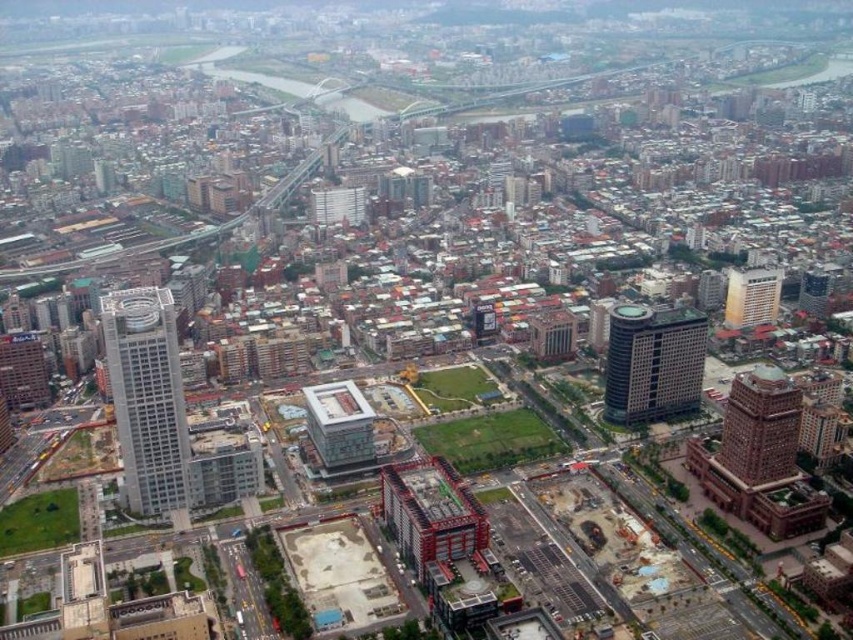
Does silver metallic skyscraper at left have a lesser height compared to white glossy building at upper right?

No, silver metallic skyscraper at left is not shorter than white glossy building at upper right.

Can you confirm if silver metallic skyscraper at left is thinner than white glossy building at upper right?

In fact, silver metallic skyscraper at left might be wider than white glossy building at upper right.

Identify the location of silver metallic skyscraper at left. (148, 396).

Can you confirm if white concrete building at center is taller than matte gray building at center?

Correct, white concrete building at center is much taller as matte gray building at center.

Does white concrete building at center appear under matte gray building at center?

Correct, white concrete building at center is located below matte gray building at center.

Who is more distant from viewer, (360,397) or (322,200)?

Positioned behind is point (322,200).

At what (x,y) coordinates should I click in order to perform the action: click on white concrete building at center. Please return your answer as a coordinate pair (x, y). The height and width of the screenshot is (640, 853). Looking at the image, I should click on (339, 424).

Is white concrete building at center smaller than white glossy building at upper right?

Actually, white concrete building at center might be larger than white glossy building at upper right.

The width and height of the screenshot is (853, 640). Find the location of `white concrete building at center`. white concrete building at center is located at coordinates (339, 424).

Between point (331, 428) and point (747, 324), which one is positioned in front?

Point (331, 428)

Identify the location of white concrete building at center. (339, 424).